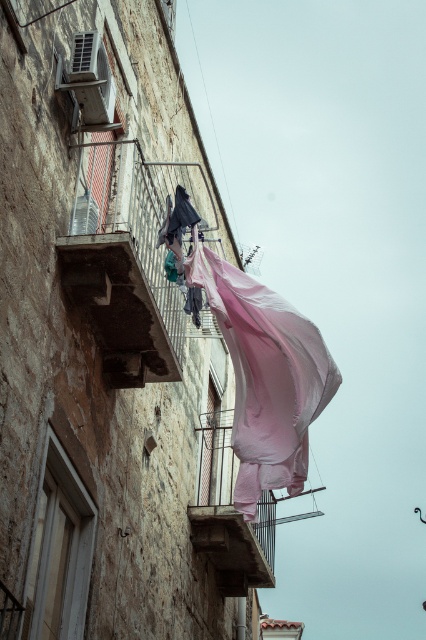
You are standing on the ground floor of the residential building and looking up at the metal mesh balcony at center. If you want to throw a ball to someone standing on the balcony, how high do you need to throw the ball?

The metal mesh balcony at center is 53.89 meters from viewer, so you need to throw the ball at least 53.89 meters high to reach it.

You are standing in front of the residential building and notice two points marked on the building facade. The first point is at coordinates point (112,358) and the second is at point (273,564). Which of these points is nearer to your current position?

Point (112,358) is closer to the camera than point (273,564), so the first point is nearer to your current position.